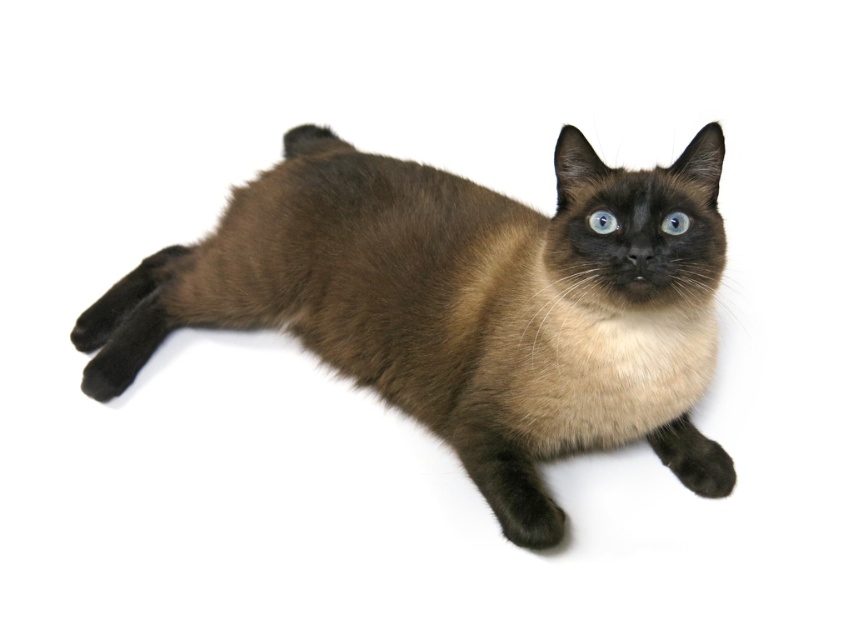
You are a photographer trying to capture a closeup of the blue glossy eye at center of the brown fur cat at center. Your camera has a depth of field that can focus on objects within a 10 inch range. Will the entire cat and eye be in focus?

The distance between the brown fur cat at center and blue glossy eye at center is 12.05 inches, which exceeds the camera depth of field range of 10 inches. Therefore, the entire cat and eye cannot be in focus simultaneously.

You are a photographer standing 5 feet away from a camera. You want to take a photo of the brown fur cat at center. If the camera is set to focus at 4 feet, will the cat be in focus?

The distance of brown fur cat at center from camera is 3.82 feet, which is within the focus range of 4 feet. Therefore, the cat will be in focus.

You are taking a photo of the Siamese cat and notice two points on its body marked as point (706,221) and point (601,211). Which point is closer to the camera?

Point (601,211) is closer to the camera because it is positioned behind point (706,221).